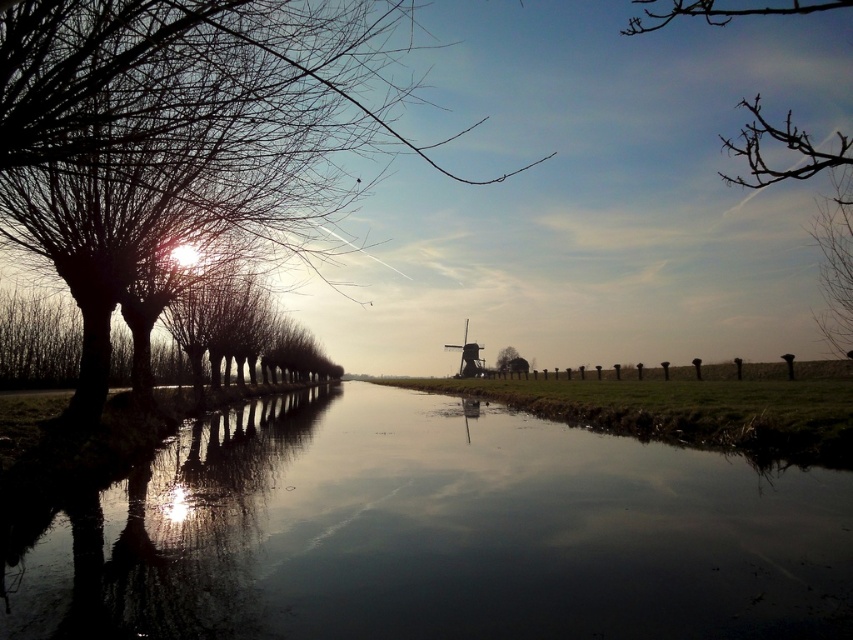
Looking at this image, you are standing at the point labeled as point (434,532) in the image. What type of surface are you currently standing on?

You are standing on smooth reflective water at center because the point (434,532) is on smooth reflective water at center.

You are standing on the bank of the waterway and want to take a photo of the green matte tree at center without the smooth reflective water at center appearing in the foreground. Is this possible?

The smooth reflective water at center is in front of the green matte tree at center, so if you are standing on the bank, the water will block the view of the tree. To avoid the water in the foreground, you would need to move to a higher elevation or position yourself where the tree is not behind the water.